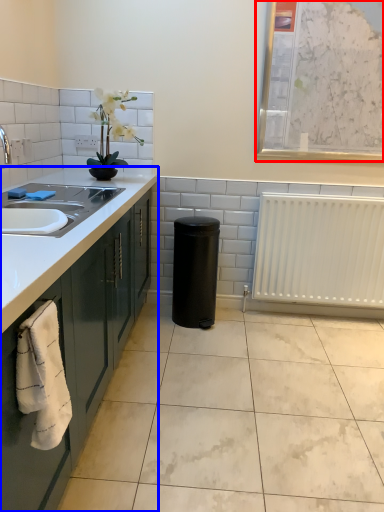
Question: Which object appears farthest to the camera in this image, bulletin board (highlighted by a red box) or countertop (highlighted by a blue box)?

Choices:
 (A) bulletin board
 (B) countertop

Answer: (A)